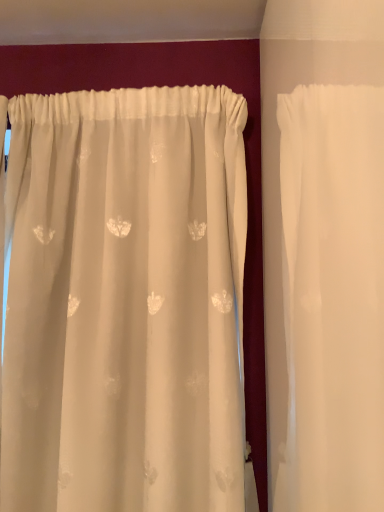
Where is `sheer white curtain at left`? Image resolution: width=384 pixels, height=512 pixels. sheer white curtain at left is located at coordinates (125, 302).

What do you see at coordinates (125, 302) in the screenshot? The image size is (384, 512). I see `sheer white curtain at left` at bounding box center [125, 302].

Find the location of `sheer white curtain at left`. sheer white curtain at left is located at coordinates (125, 302).